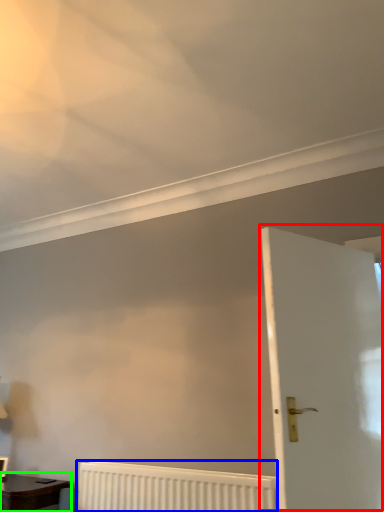
Question: Which is farther away from door (highlighted by a red box)? radiator (highlighted by a blue box) or table (highlighted by a green box)?

Choices:
 (A) radiator
 (B) table

Answer: (B)